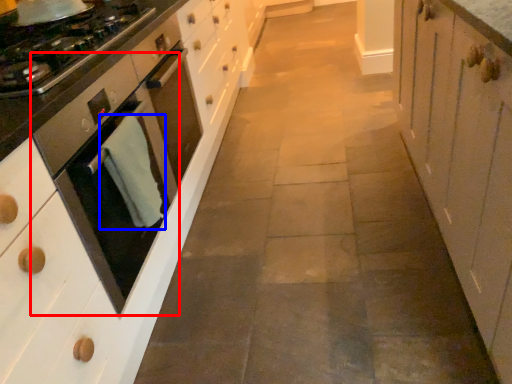
Question: Which object is closer to the camera taking this photo, home appliance (highlighted by a red box) or material (highlighted by a blue box)?

Choices:
 (A) home appliance
 (B) material

Answer: (A)